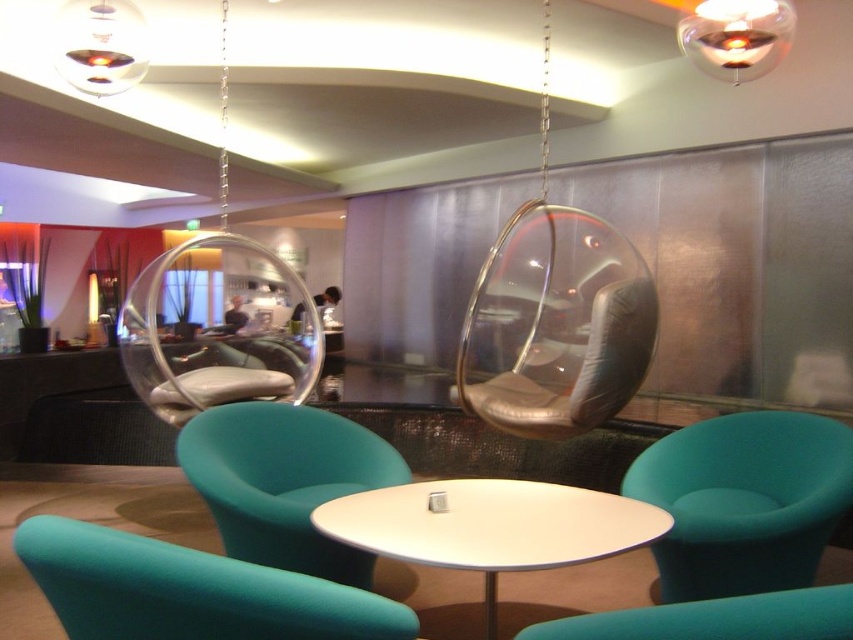
Which of these two, teal fabric armchair at lower right or teal fabric swivel chair at center, stands taller?

With more height is teal fabric armchair at lower right.

Describe the element at coordinates (744, 500) in the screenshot. I see `teal fabric armchair at lower right` at that location.

Who is more distant from viewer, (718,531) or (62,602)?

Point (718,531)

Identify the location of teal fabric armchair at lower right. This screenshot has width=853, height=640. (744, 500).

Who is lower down, teal fabric swivel chair at center or white glossy table at center?

white glossy table at center is below.

Can you confirm if teal fabric swivel chair at center is positioned below white glossy table at center?

Actually, teal fabric swivel chair at center is above white glossy table at center.

Does point (123, 593) lie behind point (421, 500)?

No, (123, 593) is closer to viewer.

Where is `teal fabric swivel chair at center`? teal fabric swivel chair at center is located at coordinates (189, 589).

Can you confirm if teal fabric swivel chair at center is wider than teal fabric chair at lower center?

Indeed, teal fabric swivel chair at center has a greater width compared to teal fabric chair at lower center.

Can you confirm if teal fabric swivel chair at center is taller than teal fabric chair at lower center?

Correct, teal fabric swivel chair at center is much taller as teal fabric chair at lower center.

Locate an element on the screen. This screenshot has width=853, height=640. teal fabric swivel chair at center is located at coordinates (189, 589).